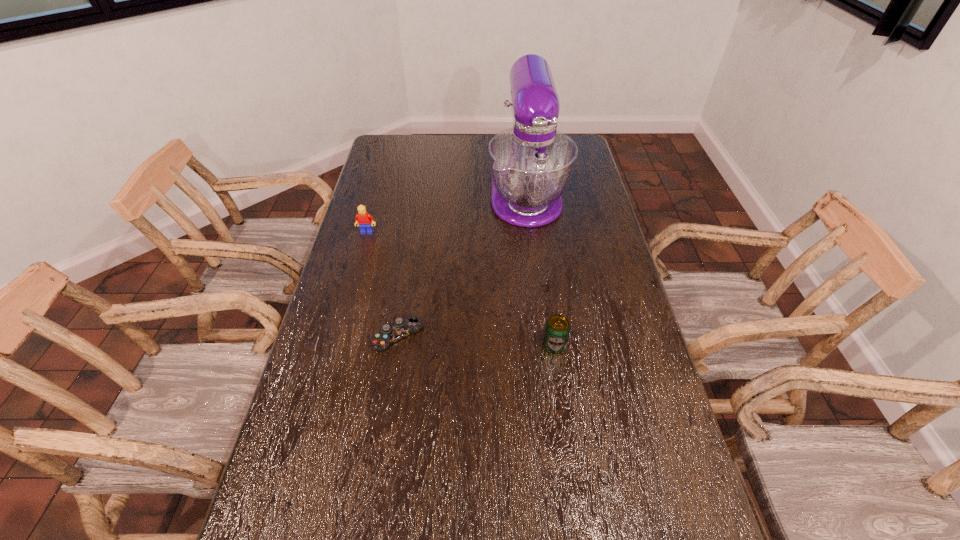
You are a GUI agent. You are given a task and a screenshot of the screen. Output one action in this format:
    pyautogui.click(x=<x>, y=<y>)
    Task: Click on the tallest object
    The height and width of the screenshot is (540, 960).
    Given the screenshot: What is the action you would take?
    pyautogui.click(x=531, y=164)

Where is `the leftmost object`? Image resolution: width=960 pixels, height=540 pixels. the leftmost object is located at coordinates (363, 219).

Identify the location of the second shortest object. The height and width of the screenshot is (540, 960). (557, 329).

The height and width of the screenshot is (540, 960). What are the coordinates of `the third object from right to left` in the screenshot? It's located at (401, 328).

Locate an element on the screen. The width and height of the screenshot is (960, 540). control is located at coordinates (401, 328).

Identify the location of free point located at the bowl opening of the tallest object. The image size is (960, 540). (540, 305).

You are a GUI agent. You are given a task and a screenshot of the screen. Output one action in this format:
    pyautogui.click(x=<x>, y=<y>)
    Task: Click on the vacant space situated 0.150m on the face of the Lego
    The image size is (960, 540).
    Given the screenshot: What is the action you would take?
    pyautogui.click(x=358, y=264)

Where is `free location located on the left of the beer can`? Image resolution: width=960 pixels, height=540 pixels. free location located on the left of the beer can is located at coordinates (471, 345).

Where is `vacant region located 0.210m on the back of the control`? The height and width of the screenshot is (540, 960). vacant region located 0.210m on the back of the control is located at coordinates (408, 269).

At what (x,y) coordinates should I click in order to perform the action: click on object positioned at the far edge. Please return your answer as a coordinate pair (x, y). The image size is (960, 540). Looking at the image, I should click on (531, 164).